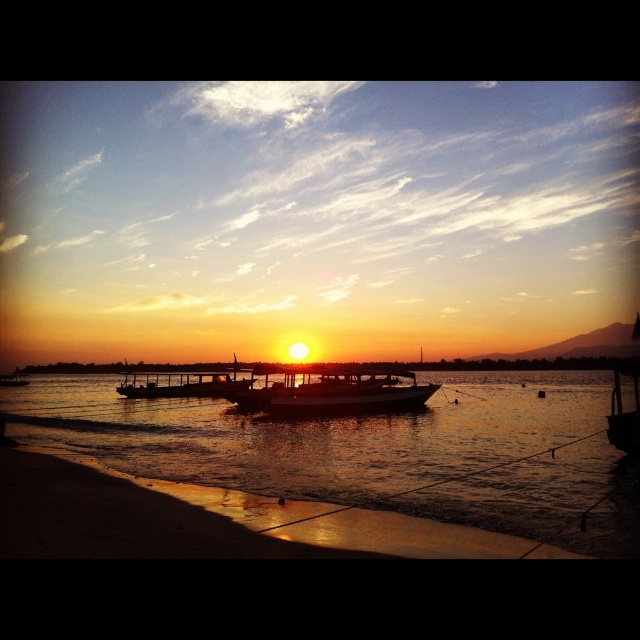
Question: Which is farther from the silvery metallic boat at center?

Choices:
 (A) translucent water at lower center
 (B) white matte boat at center
 (C) metallic silver boat at lower left

Answer: (C)

Question: Which point is farther to the camera?

Choices:
 (A) (563, 438)
 (B) (26, 381)
 (C) (388, 387)

Answer: (B)

Question: Considering the relative positions of white matte boat at center and silvery metallic boat at center in the image provided, where is white matte boat at center located with respect to silvery metallic boat at center?

Choices:
 (A) below
 (B) above

Answer: (B)

Question: Does translucent water at lower center appear on the left side of metallic silver boat at lower left?

Choices:
 (A) no
 (B) yes

Answer: (A)

Question: Is translucent water at lower center to the right of metallic silver boat at lower left from the viewer's perspective?

Choices:
 (A) yes
 (B) no

Answer: (A)

Question: Which is farther from the translucent water at lower center?

Choices:
 (A) white matte boat at center
 (B) metallic silver boat at lower left
 (C) silvery metallic boat at center

Answer: (B)